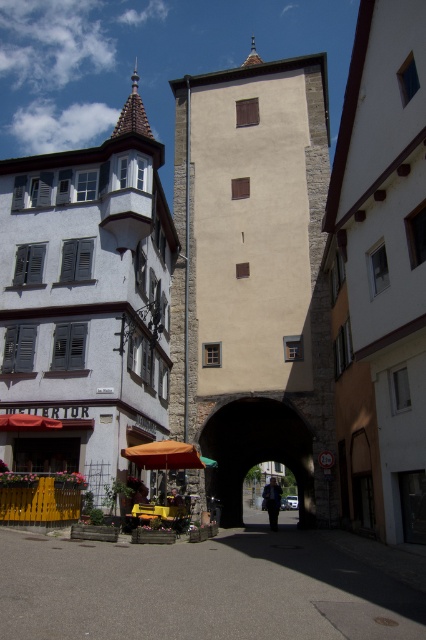
Question: Is stone archway at center positioned at the back of dark blue fabric at center?

Choices:
 (A) yes
 (B) no

Answer: (A)

Question: Can you confirm if gray concrete alley at center is positioned above stone archway at center?

Choices:
 (A) yes
 (B) no

Answer: (A)

Question: Which object is farther from the camera taking this photo?

Choices:
 (A) golden hair at center
 (B) orange fabric umbrella at lower center
 (C) stone archway at center

Answer: (C)

Question: Which of the following is the farthest from the observer?

Choices:
 (A) beige stone tower at center
 (B) stone archway at center

Answer: (B)

Question: Which object is the closest to the beige stone tower at center?

Choices:
 (A) stone archway at center
 (B) dark blue fabric at center

Answer: (A)

Question: Can you confirm if beige stone tower at center is positioned to the left of golden hair at center?

Choices:
 (A) no
 (B) yes

Answer: (A)